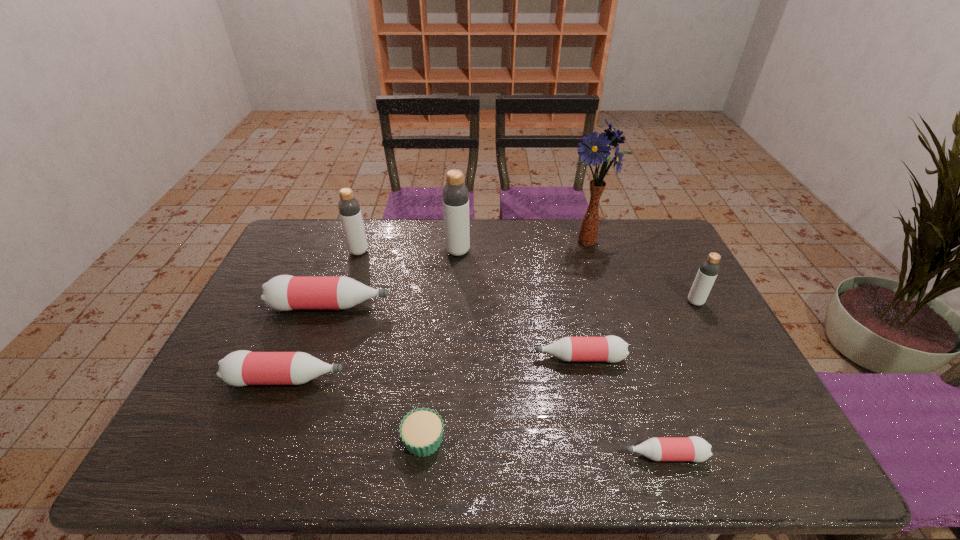
Where is `the sixth tallest object`? the sixth tallest object is located at coordinates (240, 368).

Identify the location of the second biggest pink bottle. (240, 368).

Where is `the second shortest bottle`? Image resolution: width=960 pixels, height=540 pixels. the second shortest bottle is located at coordinates (612, 349).

Where is `the third biggest pink bottle`? the third biggest pink bottle is located at coordinates (612, 349).

Find the location of a particular element. Image resolution: width=960 pixels, height=540 pixels. cupcake is located at coordinates (421, 430).

You are a GUI agent. You are given a task and a screenshot of the screen. Output one action in this format:
    pyautogui.click(x=<x>, y=<y>)
    Task: Click on the shortest bottle
    This screenshot has height=540, width=960.
    Given the screenshot: What is the action you would take?
    pyautogui.click(x=695, y=449)

Where is `the nearest pink bottle`? This screenshot has width=960, height=540. the nearest pink bottle is located at coordinates (695, 449).

The width and height of the screenshot is (960, 540). I want to click on vacant region located 0.160m on the left of the purple flower arrangement, so click(516, 241).

This screenshot has width=960, height=540. Find the location of `free space located 0.080m on the front of the eighth shortest object`. free space located 0.080m on the front of the eighth shortest object is located at coordinates (456, 274).

At what (x,y) coordinates should I click in order to perform the action: click on vacant space located on the back of the sixth shortest bottle. Please return your answer as a coordinate pair (x, y). This screenshot has height=540, width=960. Looking at the image, I should click on (369, 223).